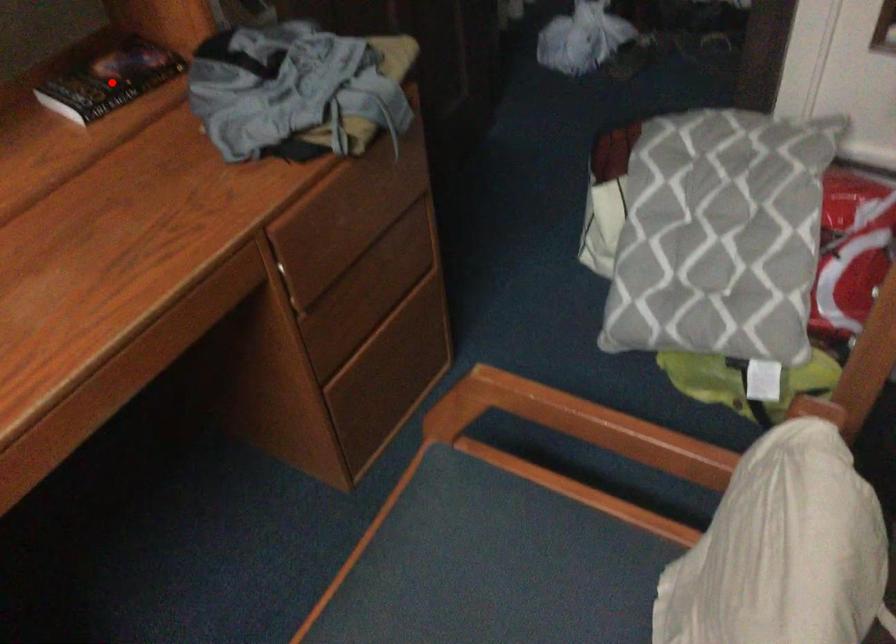
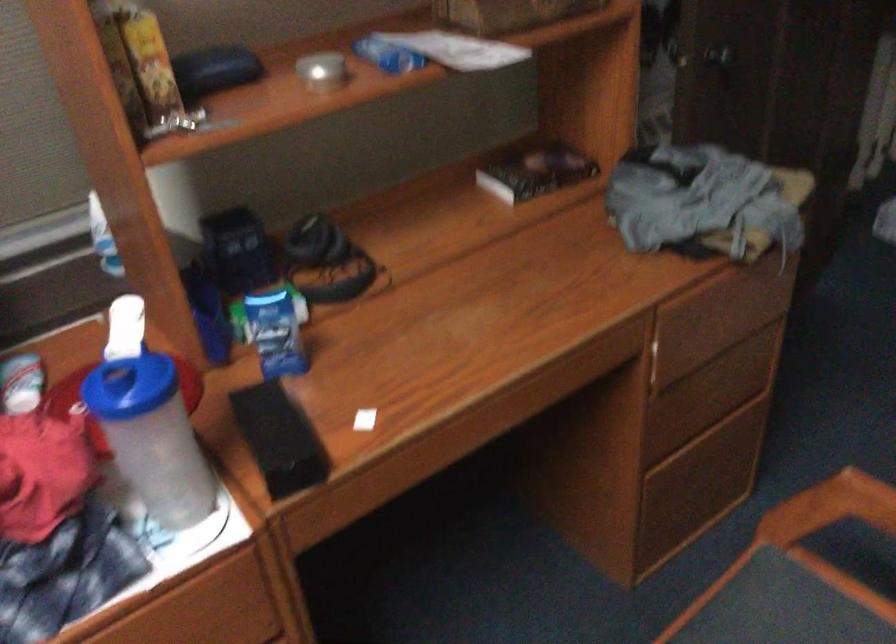
Where in the second image is the point corresponding to the highlighted location from the first image?

(536, 172)